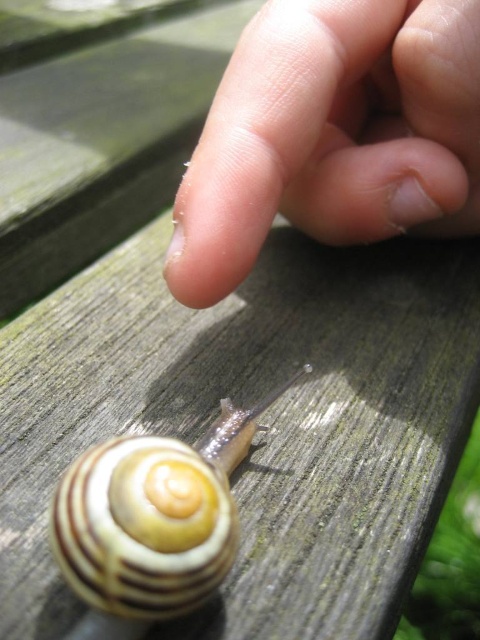
Question: Is the position of pale skin at upper center more distant than that of striped shell snail at lower left?

Choices:
 (A) no
 (B) yes

Answer: (B)

Question: Among these objects, which one is nearest to the camera?

Choices:
 (A) pale skin at upper center
 (B) striped shell snail at lower left

Answer: (B)

Question: Which point appears farthest from the camera in this image?

Choices:
 (A) (264, 42)
 (B) (230, 515)

Answer: (A)

Question: Does pale skin at upper center appear under striped shell snail at lower left?

Choices:
 (A) yes
 (B) no

Answer: (B)

Question: Is the position of pale skin at upper center more distant than that of striped shell snail at lower left?

Choices:
 (A) no
 (B) yes

Answer: (B)

Question: Which of the following is the closest to the observer?

Choices:
 (A) striped shell snail at lower left
 (B) pale skin at upper center

Answer: (A)